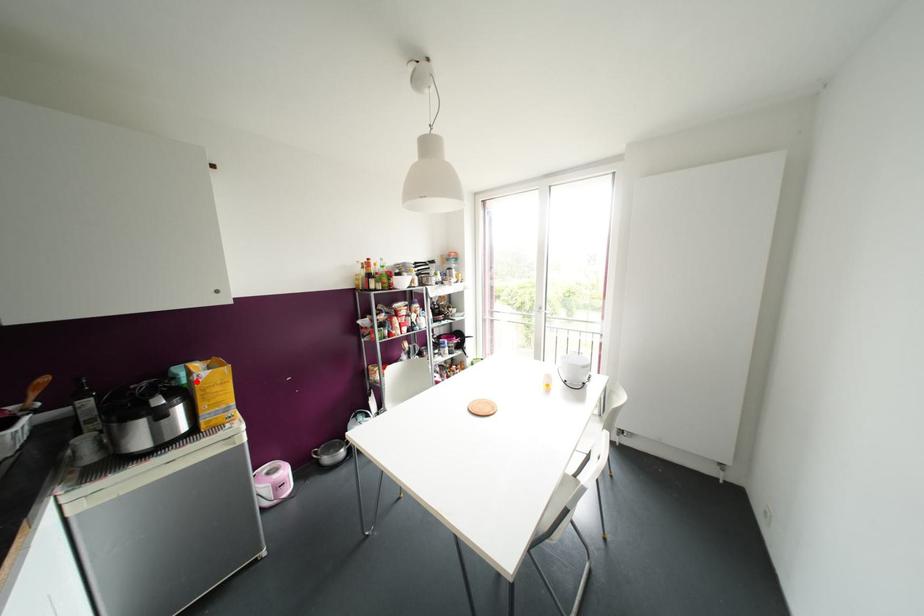
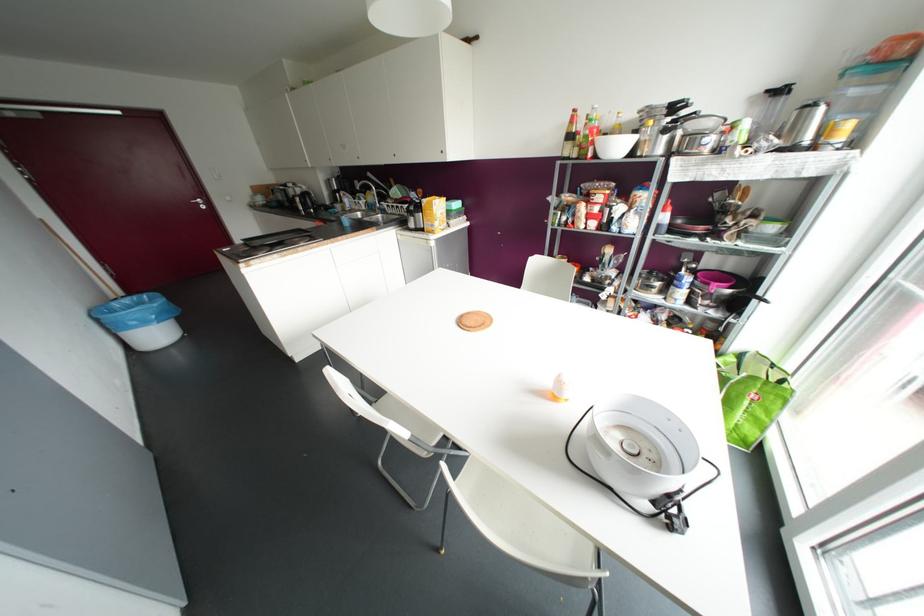
Locate, in the second image, the point that corresponds to the highlighted location in the first image.

(421, 204)